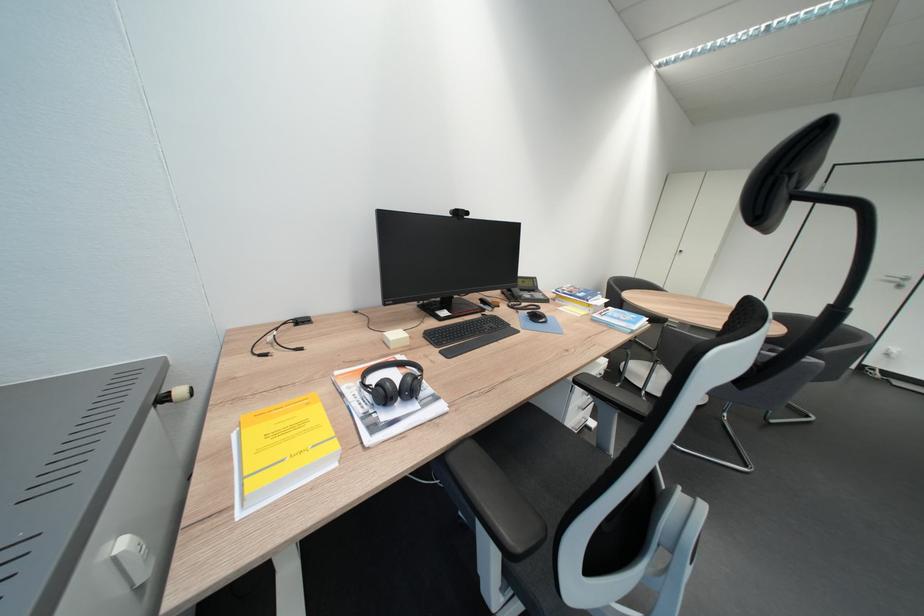
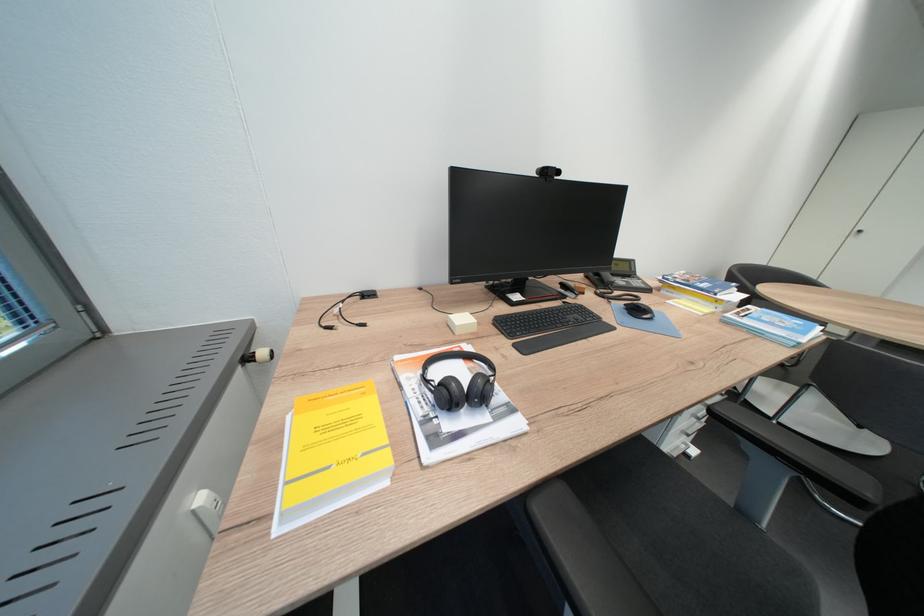
Where in the second image is the point corresponding to point 651,391 from the first image?

(781, 419)